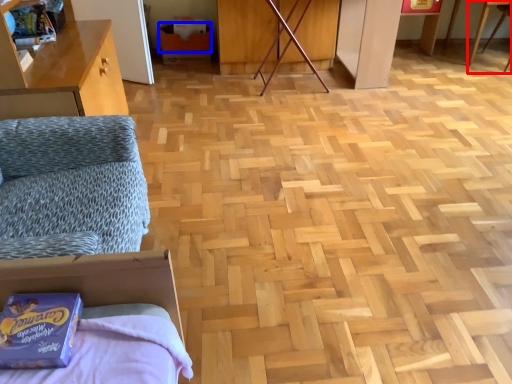
Question: Which object appears farthest to the camera in this image, table (highlighted by a red box) or cardboard box (highlighted by a blue box)?

Choices:
 (A) table
 (B) cardboard box

Answer: (B)